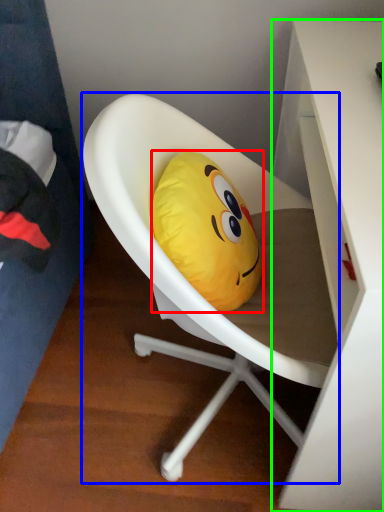
Question: Which is nearer to the pillow (highlighted by a red box)? chair (highlighted by a blue box) or desk (highlighted by a green box).

Choices:
 (A) chair
 (B) desk

Answer: (A)